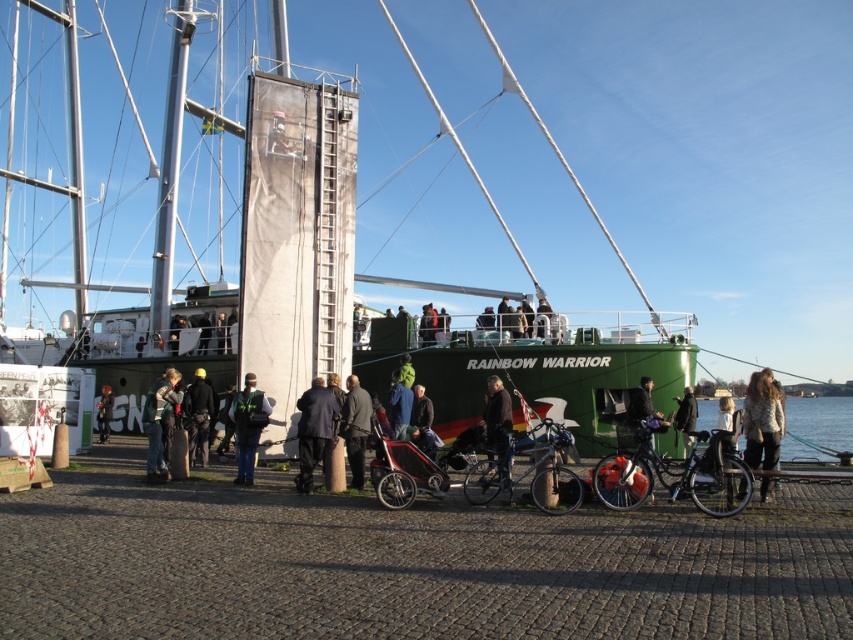
Which is more to the right, clear blue water at lower right or green fabric jacket at center?

Positioned to the right is clear blue water at lower right.

Is clear blue water at lower right below green fabric jacket at center?

Correct, clear blue water at lower right is located below green fabric jacket at center.

Does point (804, 435) come farther from viewer compared to point (154, 465)?

Yes, it is.

This screenshot has width=853, height=640. I want to click on clear blue water at lower right, so click(816, 426).

What are the coordinates of `shiny black bicycle at center` in the screenshot? It's located at (677, 474).

Between point (703, 467) and point (248, 417), which one is positioned behind?

Point (248, 417)

Where is `shiny black bicycle at center`? shiny black bicycle at center is located at coordinates point(677,474).

Identify the location of shiny black bicycle at center. (677, 474).

Can you confirm if green matte boat at center is positioned above blue fabric jacket at center?

Yes, green matte boat at center is above blue fabric jacket at center.

Can you confirm if green matte boat at center is thinner than blue fabric jacket at center?

Incorrect, green matte boat at center's width is not less than blue fabric jacket at center's.

Is point (287, 234) positioned behind point (392, 426)?

Yes, point (287, 234) is farther from viewer.

The width and height of the screenshot is (853, 640). I want to click on green matte boat at center, so click(328, 218).